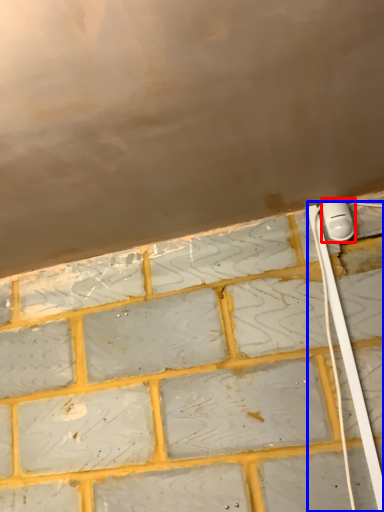
Question: Which point is further to the camera, power plugs and sockets (highlighted by a red box) or cable (highlighted by a blue box)?

Choices:
 (A) power plugs and sockets
 (B) cable

Answer: (A)